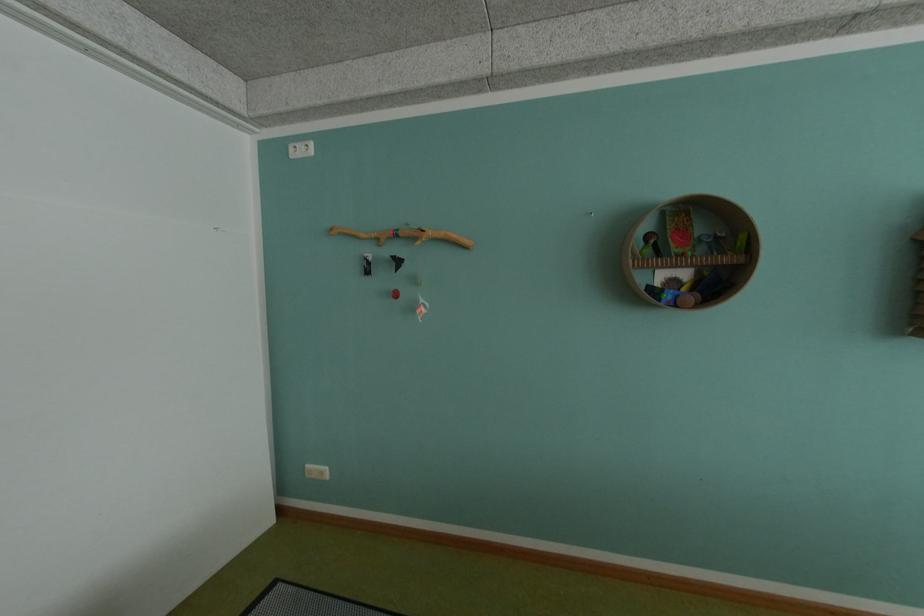
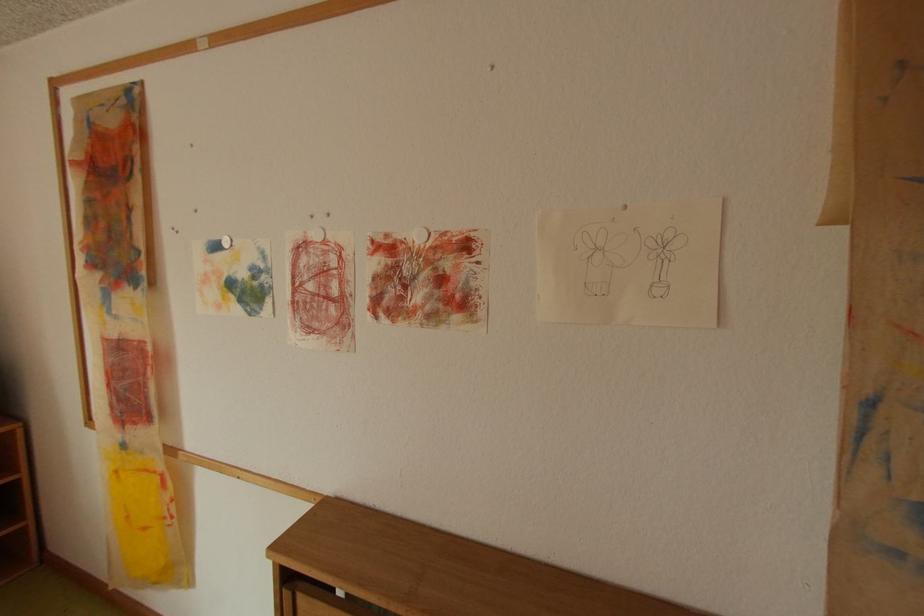
In a continuous first-person perspective shot, in which direction is the camera moving?

The cameraman walked toward left, forward.